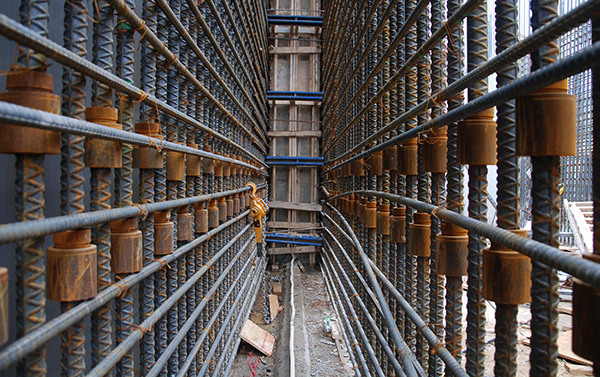
Identify the location of screen. This screenshot has height=377, width=600. (586, 176).